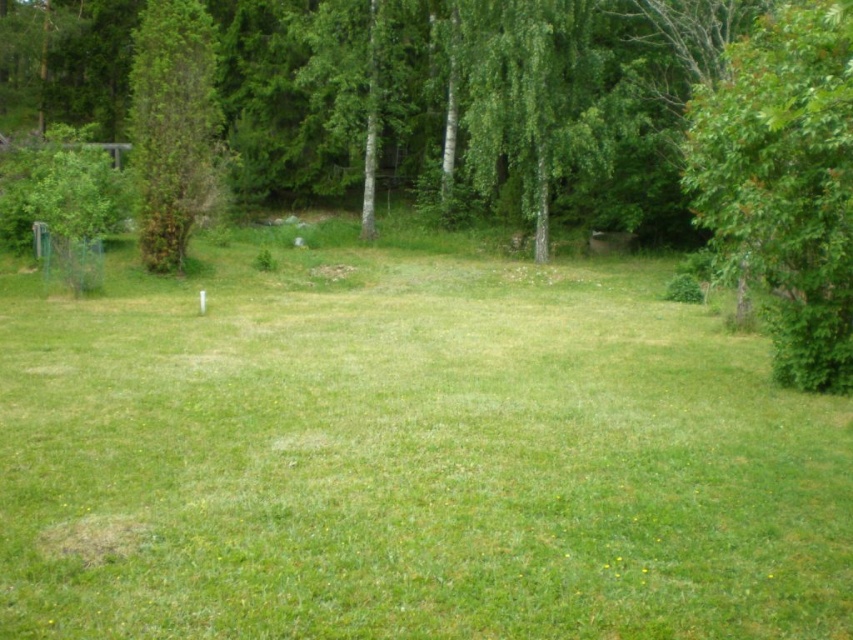
You are standing in the middle of the grassy area and see the green leafy tree at right and the green leafy tree at left. Which tree would you need to walk towards first to reach the one that is closer to you?

The green leafy tree at right is closer to the viewer, so you would first reach it without needing to walk further. You don not need to move since you are already closer to the green leafy tree at right.

You are standing at the center of the grassy area and want to walk to the green leafy tree at right. Which direction should you walk to reach it?

You should walk to the right to reach the green leafy tree at right since it is located at the right side of the scene.

You are planning to set up a picnic blanket in the middle of the green grass at center and the green leafy tree at center. Which area would be more suitable for placing the blanket based on their widths?

The green grass at center has a smaller width compared to the green leafy tree at center. Therefore, the area around the green grass at center would be more suitable for placing the picnic blanket since it is narrower and might offer a more compact space for the blanket.